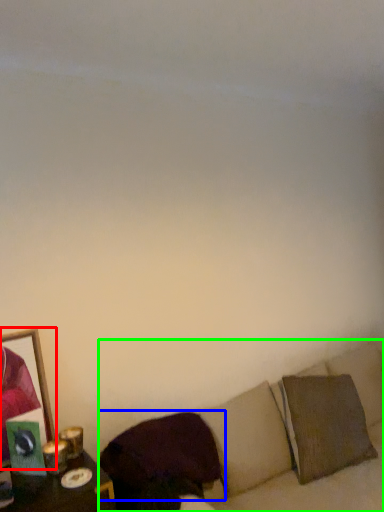
Question: Considering the real-world distances, which object is closest to picture frame (highlighted by a red box)? pillow (highlighted by a blue box) or couch (highlighted by a green box).

Choices:
 (A) pillow
 (B) couch

Answer: (A)